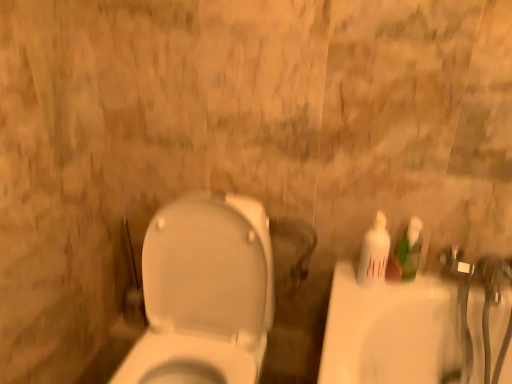
Question: Can you confirm if white glossy toilet at center is positioned to the left of white glossy bottle at right, acting as the first mouthwash starting from the left?

Choices:
 (A) yes
 (B) no

Answer: (A)

Question: Does white glossy toilet at center have a greater height compared to white glossy bottle at right, acting as the first mouthwash starting from the left?

Choices:
 (A) yes
 (B) no

Answer: (A)

Question: Can you confirm if white glossy toilet at center is smaller than white glossy bottle at right, acting as the first mouthwash starting from the left?

Choices:
 (A) yes
 (B) no

Answer: (B)

Question: From a real-world perspective, is white glossy toilet at center located beneath white glossy bottle at right, arranged as the second mouthwash when viewed from the right?

Choices:
 (A) yes
 (B) no

Answer: (A)

Question: Is white glossy toilet at center touching white glossy bottle at right, arranged as the second mouthwash when viewed from the right?

Choices:
 (A) no
 (B) yes

Answer: (A)

Question: Based on their positions, is green plastic bottle at right, which appears as the second mouthwash when viewed from the left, located to the left or right of white glossy toilet at center?

Choices:
 (A) left
 (B) right

Answer: (B)

Question: Based on their sizes in the image, would you say green plastic bottle at right, which appears as the second mouthwash when viewed from the left, is bigger or smaller than white glossy toilet at center?

Choices:
 (A) small
 (B) big

Answer: (A)

Question: Looking at their shapes, would you say green plastic bottle at right, marked as the 1th mouthwash in a right-to-left arrangement, is wider or thinner than white glossy toilet at center?

Choices:
 (A) wide
 (B) thin

Answer: (B)

Question: Considering their positions, is green plastic bottle at right, which appears as the second mouthwash when viewed from the left, located in front of or behind white glossy toilet at center?

Choices:
 (A) behind
 (B) front

Answer: (A)

Question: Looking at their shapes, would you say white glossy toilet at center is wider or thinner than green plastic bottle at right, marked as the 1th mouthwash in a right-to-left arrangement?

Choices:
 (A) thin
 (B) wide

Answer: (B)

Question: Which is correct: white glossy toilet at center is inside green plastic bottle at right, which appears as the second mouthwash when viewed from the left, or outside of it?

Choices:
 (A) inside
 (B) outside

Answer: (B)

Question: From the image's perspective, relative to green plastic bottle at right, marked as the 1th mouthwash in a right-to-left arrangement, is white glossy toilet at center above or below?

Choices:
 (A) below
 (B) above

Answer: (A)

Question: Based on their positions, is white glossy toilet at center located to the left or right of green plastic bottle at right, which appears as the second mouthwash when viewed from the left?

Choices:
 (A) right
 (B) left

Answer: (B)

Question: Is point (246, 259) closer or farther from the camera than point (380, 223)?

Choices:
 (A) closer
 (B) farther

Answer: (B)

Question: From a real-world perspective, relative to white glossy bottle at right, acting as the first mouthwash starting from the left, is white glossy toilet at center vertically above or below?

Choices:
 (A) below
 (B) above

Answer: (A)